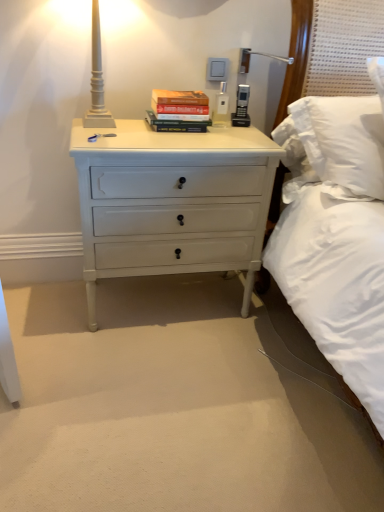
Question: From the image's perspective, is hardcover book at center above white matte lamp at upper left?

Choices:
 (A) yes
 (B) no

Answer: (B)

Question: Would you say hardcover book at center contains white matte lamp at upper left?

Choices:
 (A) no
 (B) yes

Answer: (A)

Question: Is hardcover book at center not near white matte lamp at upper left?

Choices:
 (A) no
 (B) yes

Answer: (A)

Question: Is hardcover book at center to the left of white matte lamp at upper left from the viewer's perspective?

Choices:
 (A) yes
 (B) no

Answer: (B)

Question: Is hardcover book at center shorter than white matte lamp at upper left?

Choices:
 (A) no
 (B) yes

Answer: (B)

Question: From a real-world perspective, is hardcover book at center under white matte lamp at upper left?

Choices:
 (A) no
 (B) yes

Answer: (B)

Question: From a real-world perspective, is white painted wood chest of drawers at center positioned under hardcover book at center based on gravity?

Choices:
 (A) yes
 (B) no

Answer: (A)

Question: Can you confirm if white painted wood chest of drawers at center is wider than hardcover book at center?

Choices:
 (A) yes
 (B) no

Answer: (A)

Question: Is hardcover book at center surrounded by white painted wood chest of drawers at center?

Choices:
 (A) no
 (B) yes

Answer: (A)

Question: Is white painted wood chest of drawers at center at the right side of hardcover book at center?

Choices:
 (A) yes
 (B) no

Answer: (B)

Question: Does white painted wood chest of drawers at center have a lesser width compared to hardcover book at center?

Choices:
 (A) no
 (B) yes

Answer: (A)

Question: Is white painted wood chest of drawers at center further to camera compared to hardcover book at center?

Choices:
 (A) yes
 (B) no

Answer: (B)

Question: Is white painted wood chest of drawers at center oriented towards white matte lamp at upper left?

Choices:
 (A) no
 (B) yes

Answer: (A)